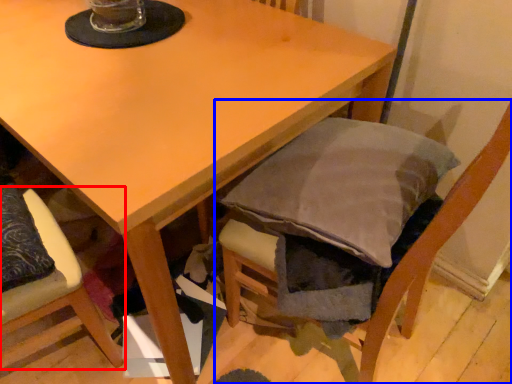
Question: Among these objects, which one is farthest to the camera, chair (highlighted by a red box) or chair (highlighted by a blue box)?

Choices:
 (A) chair
 (B) chair

Answer: (A)